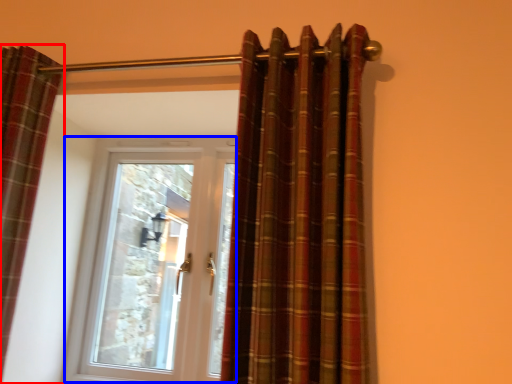
Question: Among these objects, which one is nearest to the camera, curtain (highlighted by a red box) or door (highlighted by a blue box)?

Choices:
 (A) curtain
 (B) door

Answer: (A)